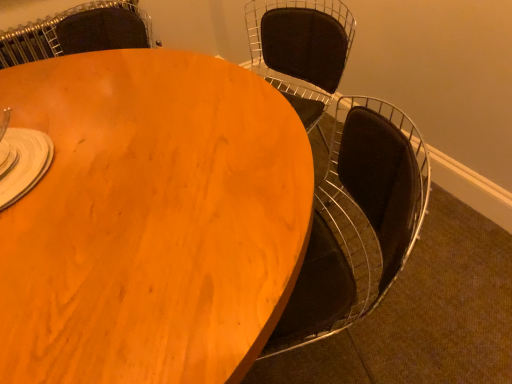
Question: From the image's perspective, is matte wood table at center positioned above or below matte black chair at upper right, positioned as the 2th chair in left-to-right order?

Choices:
 (A) above
 (B) below

Answer: (B)

Question: Visually, is matte wood table at center positioned to the left or to the right of matte black chair at upper right, positioned as the 2th chair in left-to-right order?

Choices:
 (A) right
 (B) left

Answer: (B)

Question: Based on their relative distances, which object is farther from the matte wood chair at upper center, the first chair positioned from the left?

Choices:
 (A) matte wood table at center
 (B) matte black chair at upper right, which is the 1th chair from right to left

Answer: (A)

Question: Which is farther from the matte black chair at upper right, positioned as the 2th chair in left-to-right order?

Choices:
 (A) matte wood table at center
 (B) matte wood chair at upper center, the second chair from the right

Answer: (A)